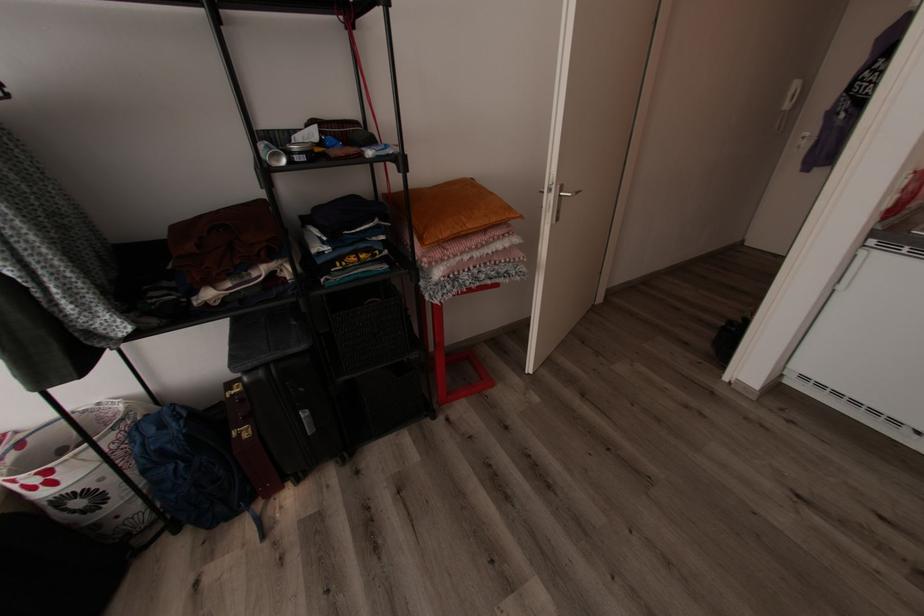
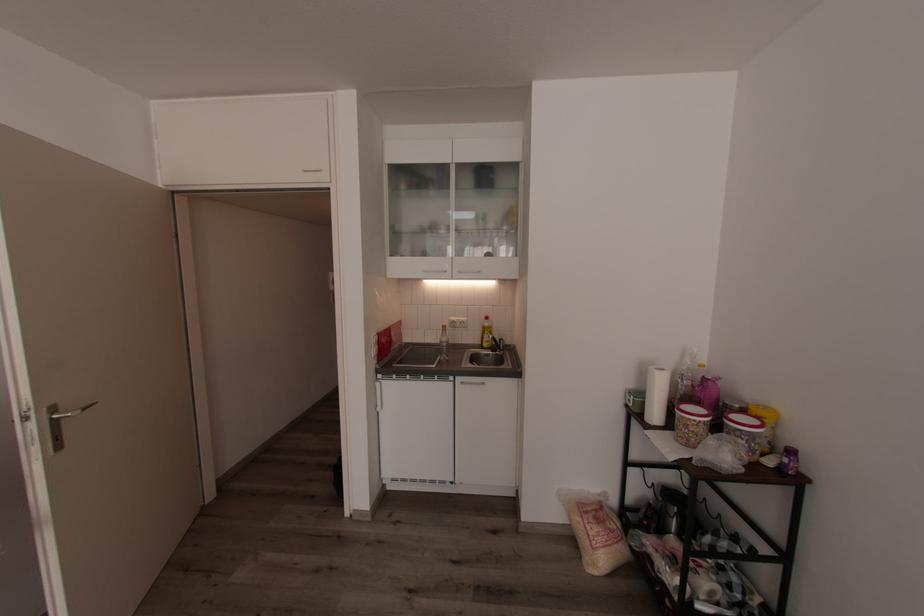
Question: The images are taken continuously from a first-person perspective. In which direction is your viewpoint rotating?

Choices:
 (A) Left
 (B) Right
 (C) Up
 (D) Down

Answer: (B)